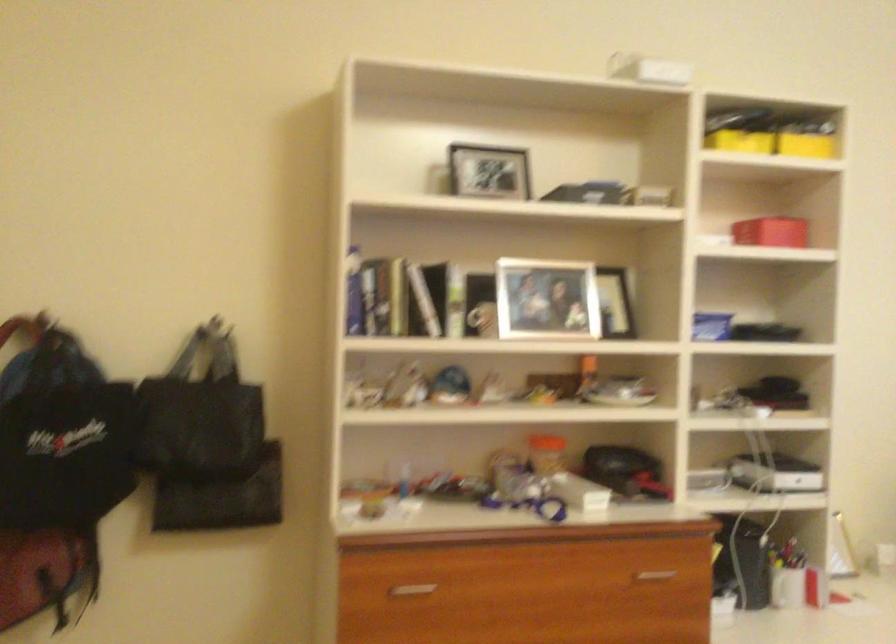
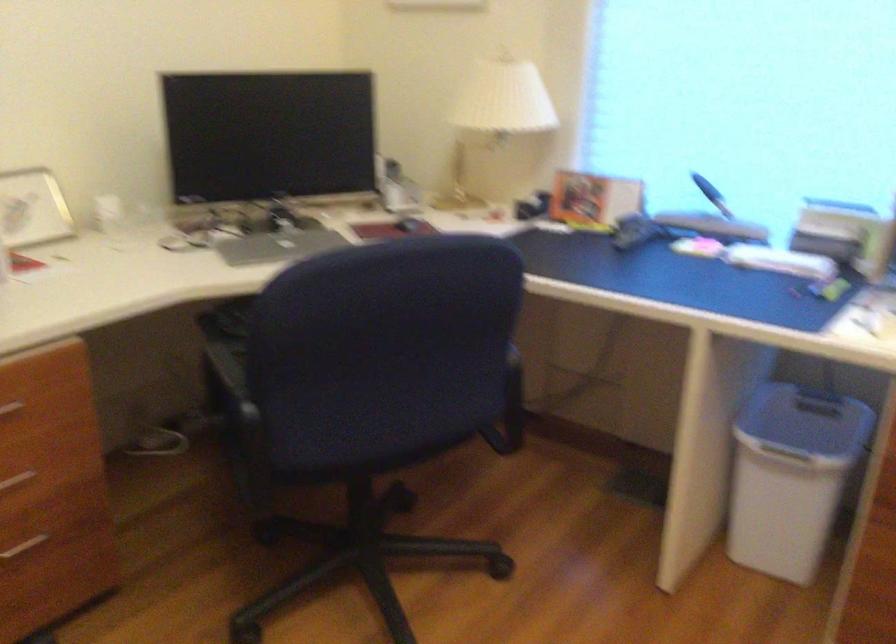
First-person continuous shooting, in which direction is the camera rotating?

The camera rotated toward right-down.